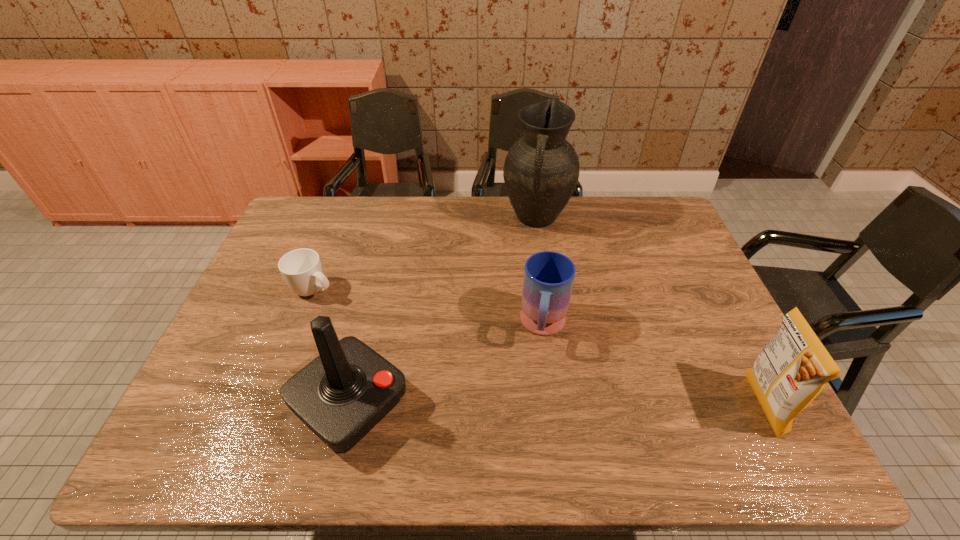
What are the coordinates of `free space located 0.320m with the handle on the side of the cup` in the screenshot? It's located at (421, 345).

At what (x,y) coordinates should I click in order to perform the action: click on vacant space located 0.250m with the handle on the side of the cup. Please return your answer as a coordinate pair (x, y). The height and width of the screenshot is (540, 960). Looking at the image, I should click on (400, 334).

Find the location of a particular element. Image resolution: width=960 pixels, height=540 pixels. free space located 0.380m on the side of the farthest object with the handle is located at coordinates (513, 330).

I want to click on free space located on the side of the farthest object with the handle, so click(x=525, y=272).

Where is `free space located on the side of the farthest object with the handle`? This screenshot has width=960, height=540. free space located on the side of the farthest object with the handle is located at coordinates (517, 306).

Locate an element on the screen. Image resolution: width=960 pixels, height=540 pixels. object that is at the far edge is located at coordinates (541, 170).

Where is `joystick that is at the near edge`? The width and height of the screenshot is (960, 540). joystick that is at the near edge is located at coordinates (341, 395).

Image resolution: width=960 pixels, height=540 pixels. I want to click on crisp (potato chip) situated at the near edge, so click(792, 369).

Locate an element on the screen. object that is at the left edge is located at coordinates coord(301,268).

Locate an element on the screen. object present at the right edge is located at coordinates (792, 369).